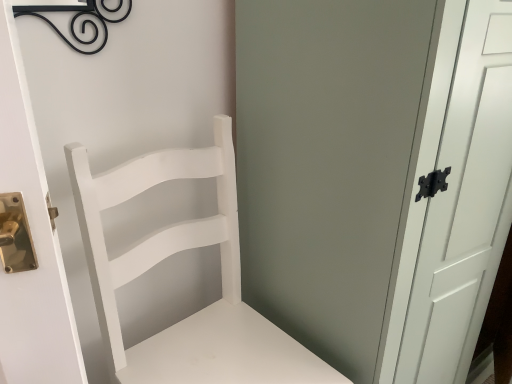
Locate an element on the screen. The width and height of the screenshot is (512, 384). white matte screen door at center is located at coordinates (326, 164).

What do you see at coordinates (326, 164) in the screenshot? I see `white matte screen door at center` at bounding box center [326, 164].

What do you see at coordinates (170, 255) in the screenshot?
I see `white matte wood chair at center` at bounding box center [170, 255].

You are a GUI agent. You are given a task and a screenshot of the screen. Output one action in this format:
    pyautogui.click(x=<x>, y=<y>)
    Task: Click on the white matte wood chair at center
    This screenshot has height=384, width=512.
    Given the screenshot: What is the action you would take?
    pyautogui.click(x=170, y=255)

You are a GUI agent. You are given a task and a screenshot of the screen. Output one action in this format:
    pyautogui.click(x=<x>, y=<y>)
    Task: Click on the white matte screen door at center
    This screenshot has height=384, width=512.
    Given the screenshot: What is the action you would take?
    pyautogui.click(x=326, y=164)

Which object is positioned more to the left, white matte wood chair at center or white matte screen door at center?

Positioned to the left is white matte wood chair at center.

Does white matte wood chair at center come in front of white matte screen door at center?

Yes, the depth of white matte wood chair at center is less than that of white matte screen door at center.

Is point (254, 336) positioned behind point (352, 51)?

Yes, it is behind point (352, 51).

Consider the image. From the image's perspective, is white matte wood chair at center located above or below white matte screen door at center?

Based on their image positions, white matte wood chair at center is located beneath white matte screen door at center.

From a real-world perspective, is white matte wood chair at center beneath white matte screen door at center?

Correct, in the physical world, white matte wood chair at center is lower than white matte screen door at center.

Considering the sizes of white matte wood chair at center and white matte screen door at center in the image, is white matte wood chair at center wider or thinner than white matte screen door at center?

In the image, white matte wood chair at center appears to be more narrow than white matte screen door at center.

Can you confirm if white matte wood chair at center is taller than white matte screen door at center?

Incorrect, the height of white matte wood chair at center is not larger of that of white matte screen door at center.

Does white matte wood chair at center have a smaller size compared to white matte screen door at center?

Yes, white matte wood chair at center is smaller than white matte screen door at center.

Is white matte wood chair at center not within white matte screen door at center?

white matte wood chair at center is positioned outside white matte screen door at center.

Is there a large distance between white matte wood chair at center and white matte screen door at center?

No, white matte wood chair at center is not far from white matte screen door at center.

Is white matte wood chair at center turned away from white matte screen door at center?

No, white matte wood chair at center's orientation is not away from white matte screen door at center.

What's the angular difference between white matte wood chair at center and white matte screen door at center's facing directions?

They differ by 2.51 degrees in their facing directions.

Measure the distance from white matte wood chair at center to white matte screen door at center.

9.57 inches.

You are a GUI agent. You are given a task and a screenshot of the screen. Output one action in this format:
    pyautogui.click(x=<x>, y=<y>)
    Task: Click on the chair below the white matte screen door at center (from a real-world perspective)
    
    Given the screenshot: What is the action you would take?
    pyautogui.click(x=170, y=255)

Is white matte screen door at center to the right of white matte wood chair at center from the viewer's perspective?

Yes, white matte screen door at center is to the right of white matte wood chair at center.

Does white matte screen door at center lie in front of white matte wood chair at center?

No, white matte screen door at center is behind white matte wood chair at center.

Does point (326, 118) appear closer or farther from the camera than point (224, 381)?

Point (326, 118).

From the image's perspective, is white matte screen door at center located above or below white matte wood chair at center?

white matte screen door at center is situated higher than white matte wood chair at center in the image.

From a real-world perspective, is white matte screen door at center on top of white matte wood chair at center?

Yes.

Which object is thinner, white matte screen door at center or white matte wood chair at center?

Thinner between the two is white matte wood chair at center.

Can you confirm if white matte screen door at center is taller than white matte wood chair at center?

Yes, white matte screen door at center is taller than white matte wood chair at center.

Who is smaller, white matte screen door at center or white matte wood chair at center?

white matte wood chair at center is smaller.

Would you say white matte screen door at center is inside or outside white matte wood chair at center?

white matte screen door at center is not inside white matte wood chair at center, it's outside.

Are white matte screen door at center and white matte wood chair at center located far from each other?

No.

Is white matte wood chair at center at the back of white matte screen door at center?

No, white matte screen door at center is not facing away from white matte wood chair at center.

Measure the distance from white matte screen door at center to white matte wood chair at center.

white matte screen door at center and white matte wood chair at center are 9.57 inches apart.

Find the location of a particular element. chair in front of the white matte screen door at center is located at coordinates (170, 255).

Where is `screen door behind the white matte wood chair at center`? The height and width of the screenshot is (384, 512). screen door behind the white matte wood chair at center is located at coordinates (326, 164).

Find the location of a particular element. The image size is (512, 384). screen door positioned vertically above the white matte wood chair at center (from a real-world perspective) is located at coordinates (326, 164).